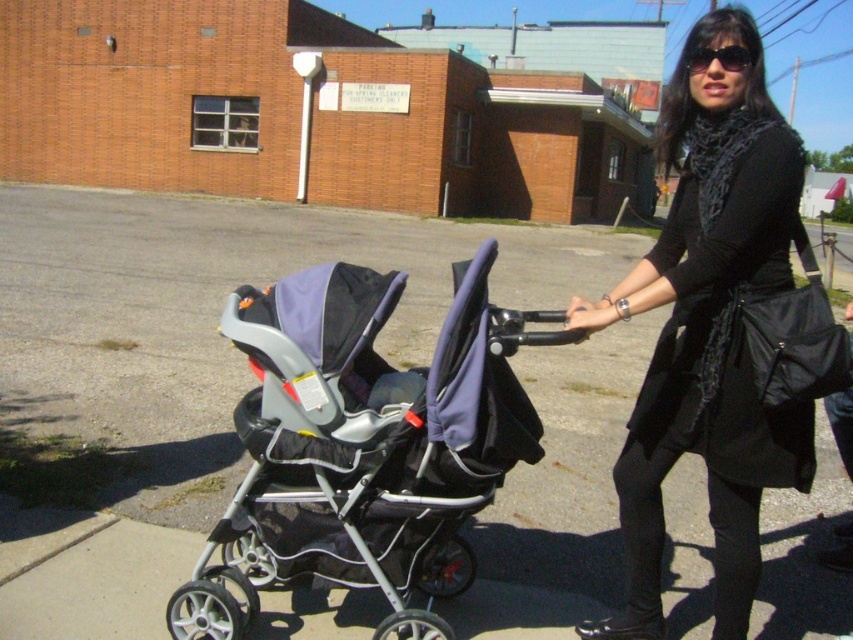
Question: Which of the following is the closest to the observer?

Choices:
 (A) silver metallic stroller at center
 (B) black matte coat at center
 (C) gray asphalt pavement at center

Answer: (A)

Question: Is gray asphalt pavement at center positioned before silver metallic stroller at center?

Choices:
 (A) yes
 (B) no

Answer: (B)

Question: Does silver metallic stroller at center have a larger size compared to sunglasses at upper center?

Choices:
 (A) no
 (B) yes

Answer: (B)

Question: Which object is positioned closest to the gray asphalt pavement at center?

Choices:
 (A) silver metallic stroller at center
 (B) sunglasses at upper center
 (C) black matte coat at center

Answer: (C)

Question: Which of the following is the farthest from the observer?

Choices:
 (A) (448, 339)
 (B) (700, 56)
 (C) (581, 371)
 (D) (695, 124)

Answer: (C)

Question: Does silver metallic stroller at center have a larger size compared to sunglasses at upper center?

Choices:
 (A) no
 (B) yes

Answer: (B)